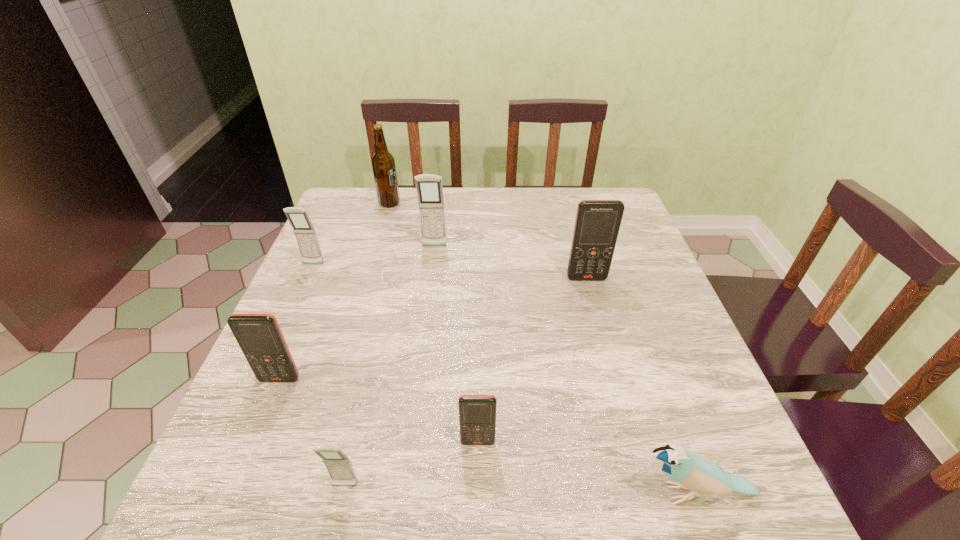
The image size is (960, 540). I want to click on object at the near right corner, so click(687, 470).

At what (x,y) coordinates should I click in order to perform the action: click on free region at the far edge of the desktop. Please return your answer as a coordinate pair (x, y). The width and height of the screenshot is (960, 540). Looking at the image, I should click on (520, 200).

The image size is (960, 540). In the image, there is a desktop. Find the location of `vacant space at the near edge`. vacant space at the near edge is located at coordinates (409, 512).

Image resolution: width=960 pixels, height=540 pixels. Identify the location of vacant space at the left edge of the desktop. [332, 249].

You are a GUI agent. You are given a task and a screenshot of the screen. Output one action in this format:
    pyautogui.click(x=<x>, y=<y>)
    Task: Click on the blank area at the right edge
    This screenshot has height=540, width=960.
    Given the screenshot: What is the action you would take?
    pyautogui.click(x=638, y=362)

This screenshot has height=540, width=960. Find the location of `free region at the near left corner`. free region at the near left corner is located at coordinates (266, 477).

This screenshot has width=960, height=540. Find the location of `vacant space at the far right corner of the desktop`. vacant space at the far right corner of the desktop is located at coordinates 596,194.

Image resolution: width=960 pixels, height=540 pixels. In order to click on vacant region between the nearest cellular telephone and the fourth farthest object in this screenshot , I will do `click(466, 382)`.

I want to click on vacant space that is in between the beer bottle and the smallest orange cellular telephone, so click(434, 322).

Find the location of a particular element. vacant space that's between the fifth farthest object and the rightmost gray cellular telephone is located at coordinates (357, 313).